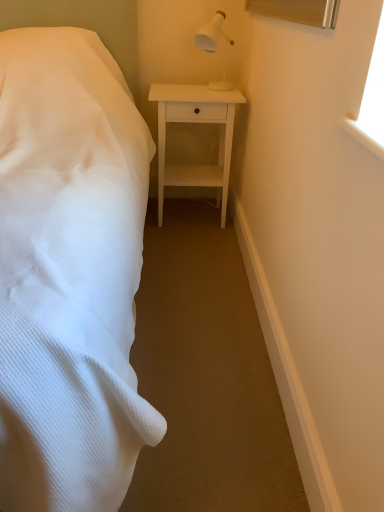
Question: Should I look upward or downward to see white matte nightstand at center?

Choices:
 (A) down
 (B) up

Answer: (B)

Question: Is white matte nightstand at center at the right side of white textured bed at left?

Choices:
 (A) yes
 (B) no

Answer: (A)

Question: Is white matte nightstand at center far away from white textured bed at left?

Choices:
 (A) yes
 (B) no

Answer: (B)

Question: Does white matte nightstand at center have a smaller size compared to white textured bed at left?

Choices:
 (A) no
 (B) yes

Answer: (B)

Question: From the image's perspective, would you say white matte nightstand at center is positioned over white textured bed at left?

Choices:
 (A) no
 (B) yes

Answer: (B)

Question: From a real-world perspective, is white matte nightstand at center on white textured bed at left?

Choices:
 (A) no
 (B) yes

Answer: (A)

Question: Is white matte nightstand at center shorter than white textured bed at left?

Choices:
 (A) yes
 (B) no

Answer: (A)

Question: Is white textured bed at left at the right side of white plastic lamp at upper right?

Choices:
 (A) yes
 (B) no

Answer: (B)

Question: Can you confirm if white textured bed at left is taller than white plastic lamp at upper right?

Choices:
 (A) no
 (B) yes

Answer: (B)

Question: Is the position of white textured bed at left less distant than that of white plastic lamp at upper right?

Choices:
 (A) no
 (B) yes

Answer: (B)

Question: Can we say white textured bed at left lies outside white plastic lamp at upper right?

Choices:
 (A) no
 (B) yes

Answer: (B)

Question: Does white textured bed at left turn towards white plastic lamp at upper right?

Choices:
 (A) no
 (B) yes

Answer: (A)

Question: From the image's perspective, is white textured bed at left located beneath white plastic lamp at upper right?

Choices:
 (A) no
 (B) yes

Answer: (B)

Question: Is white plastic lamp at upper right beside white matte nightstand at center?

Choices:
 (A) yes
 (B) no

Answer: (B)